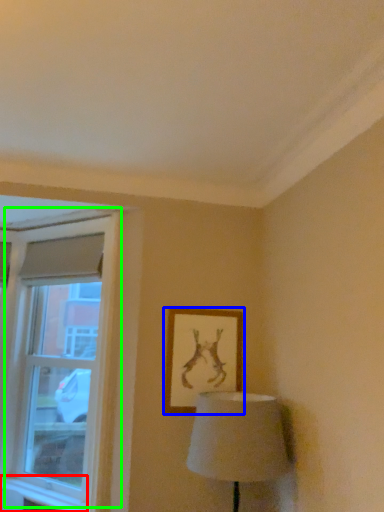
Question: Which is farther away from window sill (highlighted by a red box)? picture frame (highlighted by a blue box) or window (highlighted by a green box)?

Choices:
 (A) picture frame
 (B) window

Answer: (A)